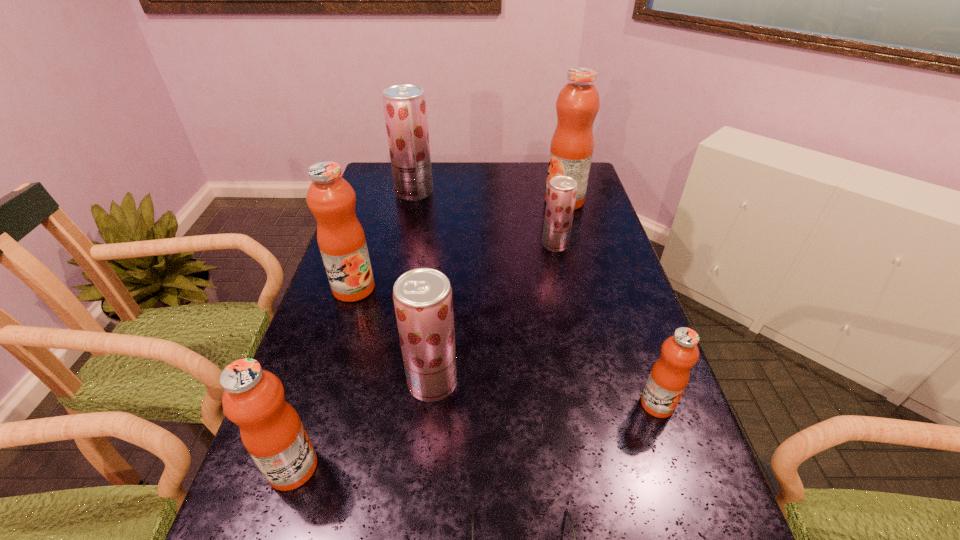
Find the location of a particular element. free space that satisfies the following two spatial constraints: 1. on the front label of the second biggest orange fruit juice; 2. on the front label of the second nearest object is located at coordinates (x=297, y=467).